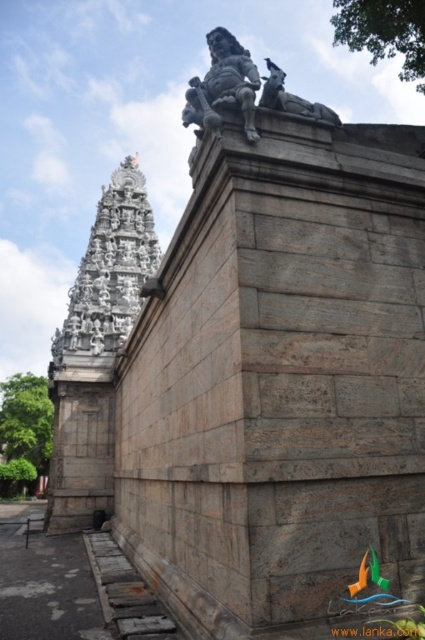
Who is lower down, white stone temple at upper left or gray stone lion at upper center?

Positioned lower is gray stone lion at upper center.

Does white stone temple at upper left appear under gray stone lion at upper center?

No, white stone temple at upper left is not below gray stone lion at upper center.

Where is `white stone temple at upper left`? white stone temple at upper left is located at coordinates (110, 273).

Image resolution: width=425 pixels, height=640 pixels. Describe the element at coordinates (223, 84) in the screenshot. I see `slate gray stone statue at upper center` at that location.

How much distance is there between slate gray stone statue at upper center and gray stone lion at upper center?

slate gray stone statue at upper center is 13.55 feet away from gray stone lion at upper center.

Measure the distance between slate gray stone statue at upper center and camera.

32.63 meters

I want to click on slate gray stone statue at upper center, so click(x=223, y=84).

Does white stone temple at upper left have a smaller size compared to slate gray stone statue at upper center?

Actually, white stone temple at upper left might be larger than slate gray stone statue at upper center.

Is white stone temple at upper left above slate gray stone statue at upper center?

Correct, white stone temple at upper left is located above slate gray stone statue at upper center.

Is point (133, 221) positioned after point (215, 88)?

Yes, it is.

Identify the location of white stone temple at upper left. The image size is (425, 640). (110, 273).